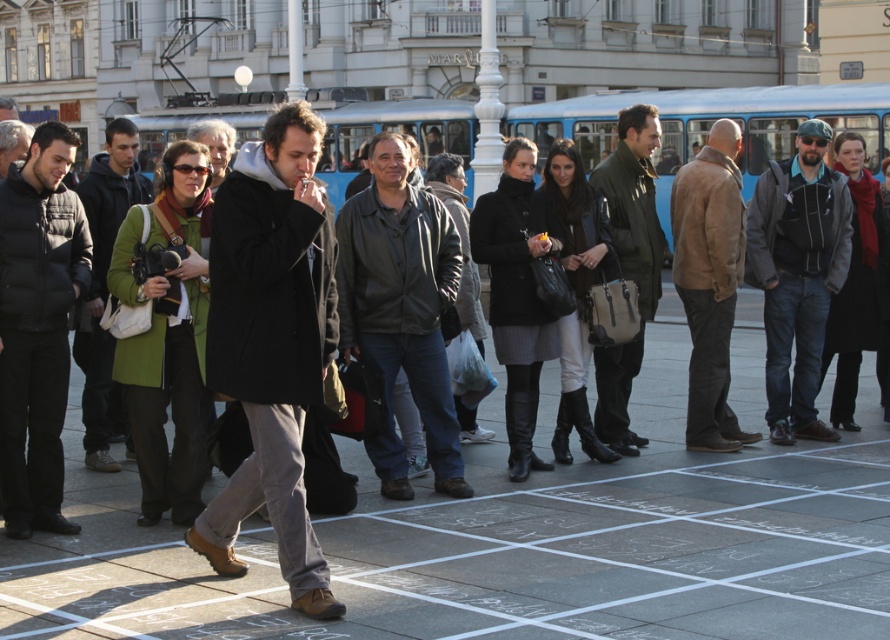
Question: Considering the relative positions of dark gray leather jacket at right and matte green jacket at center in the image provided, where is dark gray leather jacket at right located with respect to matte green jacket at center?

Choices:
 (A) above
 (B) below

Answer: (A)

Question: From the image, what is the correct spatial relationship of brown leather jacket at center in relation to matte black coat at center?

Choices:
 (A) above
 (B) below

Answer: (B)

Question: Which object is positioned farthest from the black puffer jacket at left?

Choices:
 (A) dark gray leather jacket at right
 (B) dark gray wool coat at center

Answer: (A)

Question: Which point appears closest to the camera in this image?

Choices:
 (A) (716, 138)
 (B) (798, 403)
 (C) (115, 157)
 (D) (3, 388)

Answer: (D)

Question: Based on their relative distances, which object is nearer to the brown leather jacket at center?

Choices:
 (A) green wool coat at center
 (B) matte green jacket at center

Answer: (B)

Question: Does brown leather jacket at center appear on the right side of matte green jacket at center?

Choices:
 (A) yes
 (B) no

Answer: (A)